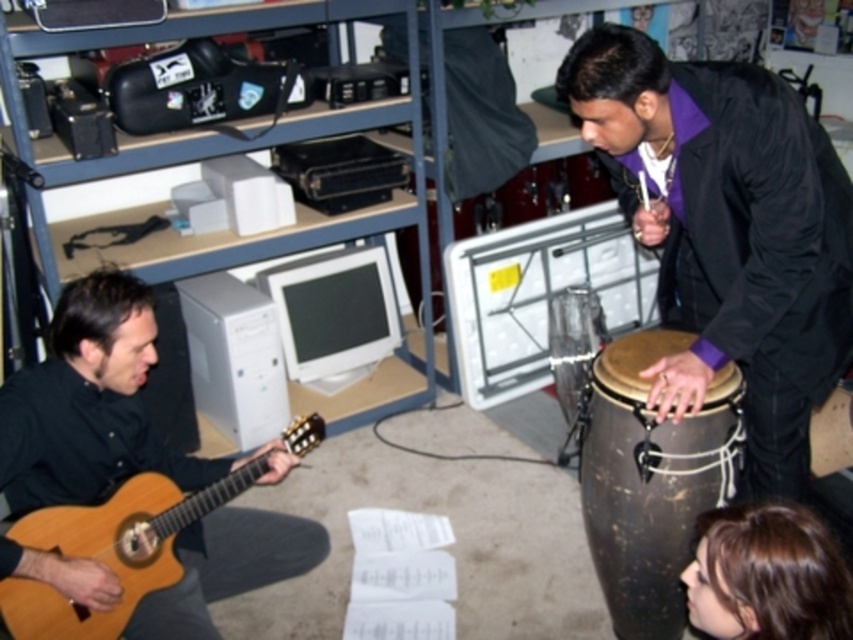
You are a photographer setting up for a live performance. You need to position a spotlight on the shiny black jacket at right and the brown leather drum at lower center. According to the scene description, which object should you place the spotlight closer to if you want to highlight the one that is more to the right?

The shiny black jacket at right is positioned on the right side of the brown leather drum at lower center, so you should place the spotlight closer to the shiny black jacket at right since it is more to the right.

You are standing in the room and see the point at coordinates (650, 480). Which object is this point located on?

The point at coordinates (650, 480) is located on the brown leather drum at lower center.

Based on the photo, you are a photographer standing in front of the scene. You want to take a photo of both the shiny black jacket at right and the brown leather drum at lower center in the same frame. The minimum distance between the two objects to fit both in the frame is 25 centimeters. Can you capture both in one shot?

The shiny black jacket at right and the brown leather drum at lower center are 26.66 centimeters apart from each other. Since the required minimum distance is 25 centimeters, the photographer can capture both in one shot as the distance is sufficient.